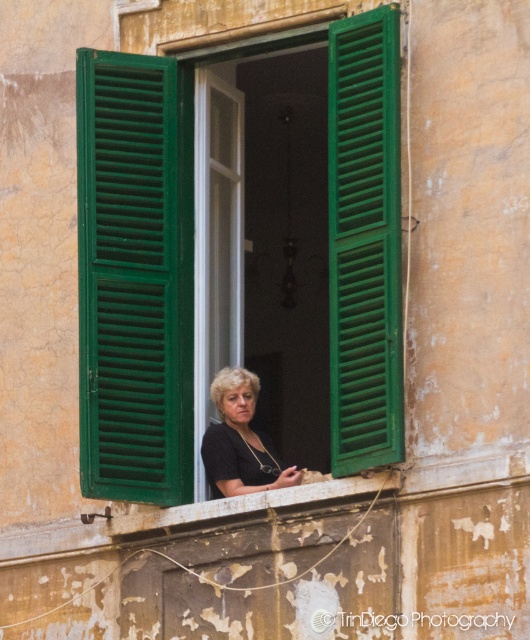
You are standing in front of a building with a warm yellow wall. You see a green matte shutters at center and a black matte shirt at center. Which object is positioned to the left when viewed from the front of the building?

The green matte shutters at center are positioned to the left of the black matte shirt at center when viewed from the front of the building.